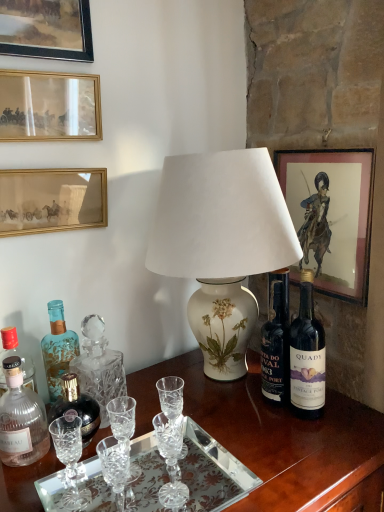
Identify the location of vacant area on top of wooden desk at center (from a real-world perspective). Image resolution: width=384 pixels, height=512 pixels. (182, 425).